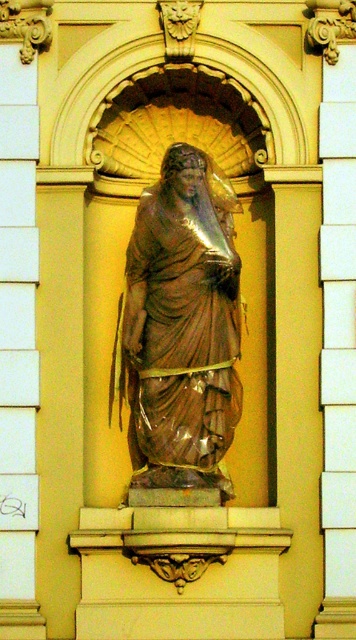
Question: Does bronze statue at center come in front of white stone pillar at right?

Choices:
 (A) yes
 (B) no

Answer: (B)

Question: Is white marble pillar at left bigger than white stone pillar at right?

Choices:
 (A) no
 (B) yes

Answer: (B)

Question: Which point is closer to the camera?

Choices:
 (A) (342, 456)
 (B) (14, 401)
 (C) (213, 188)

Answer: (B)

Question: Which point is farther to the camera?

Choices:
 (A) (17, 420)
 (B) (338, 188)
 (C) (173, 483)

Answer: (B)

Question: Is white marble pillar at left thinner than white stone pillar at right?

Choices:
 (A) yes
 (B) no

Answer: (B)

Question: Which object appears closest to the camera in this image?

Choices:
 (A) bronze statue at center
 (B) white stone pillar at right
 (C) white marble pillar at left

Answer: (C)